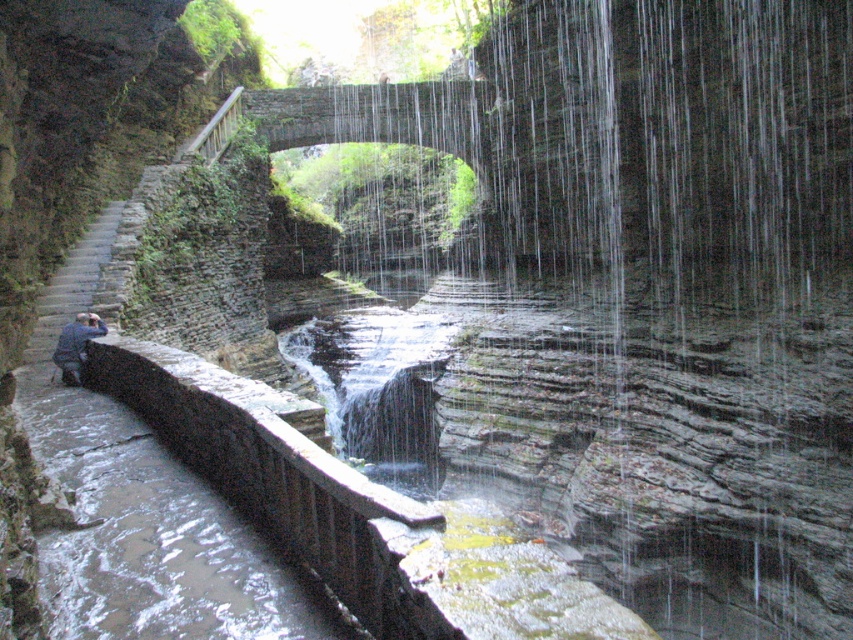
You are standing on the stone bridge and want to cross to the other side. You notice the clear water at center and the brown stone rail at lower left. Which object is larger in size?

The clear water at center is bigger than the brown stone rail at lower left, so the clear water at center is larger in size.

You are standing at the stone bridge in the canyon and want to take a photo. There are two points marked in the scene. The first point is at coordinate point (286, 525) and the second point is at coordinate point (78, 385). Which point is closer to your camera when taking the photo?

Point (286, 525) is closer to the camera than point (78, 385).